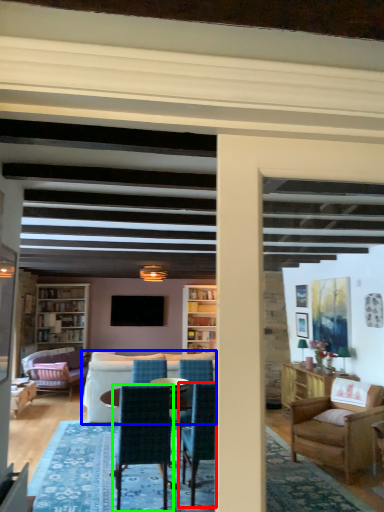
Question: Which object is positioned farthest from chair (highlighted by a red box)? Select from studio couch (highlighted by a blue box) and chair (highlighted by a green box).

Choices:
 (A) studio couch
 (B) chair

Answer: (A)